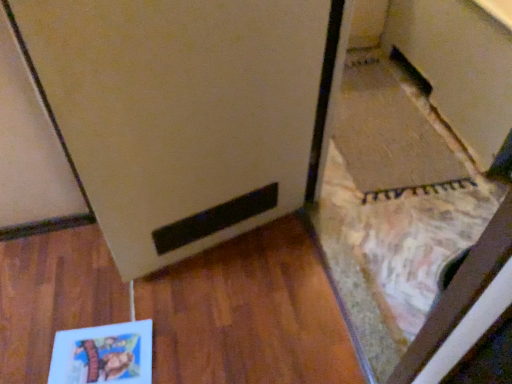
Question: Is matte brown cabinet at lower right positioned far away from matte paper book at lower left?

Choices:
 (A) yes
 (B) no

Answer: (A)

Question: Can you confirm if matte brown cabinet at lower right is smaller than matte paper book at lower left?

Choices:
 (A) yes
 (B) no

Answer: (B)

Question: Is matte brown cabinet at lower right behind matte paper book at lower left?

Choices:
 (A) no
 (B) yes

Answer: (B)

Question: Does matte brown cabinet at lower right have a greater height compared to matte paper book at lower left?

Choices:
 (A) yes
 (B) no

Answer: (A)

Question: From the image's perspective, is matte brown cabinet at lower right located beneath matte paper book at lower left?

Choices:
 (A) yes
 (B) no

Answer: (B)

Question: Is matte paper book at lower left in front of or behind matte brown cabinet at lower right in the image?

Choices:
 (A) front
 (B) behind

Answer: (A)

Question: Is matte paper book at lower left bigger or smaller than matte brown cabinet at lower right?

Choices:
 (A) big
 (B) small

Answer: (B)

Question: From their relative heights in the image, would you say matte paper book at lower left is taller or shorter than matte brown cabinet at lower right?

Choices:
 (A) tall
 (B) short

Answer: (B)

Question: From the image's perspective, is matte paper book at lower left positioned above or below matte brown cabinet at lower right?

Choices:
 (A) above
 (B) below

Answer: (B)

Question: Is matte brown cabinet at lower right bigger or smaller than matte paper book at lower left?

Choices:
 (A) big
 (B) small

Answer: (A)

Question: Is point (484, 117) positioned closer to the camera than point (54, 370)?

Choices:
 (A) closer
 (B) farther

Answer: (B)

Question: Based on their positions, is matte brown cabinet at lower right located to the left or right of matte paper book at lower left?

Choices:
 (A) left
 (B) right

Answer: (B)

Question: From the image's perspective, is matte brown cabinet at lower right above or below matte paper book at lower left?

Choices:
 (A) below
 (B) above

Answer: (B)

Question: Is matte paper book at lower left inside the boundaries of matte white fridge at center, or outside?

Choices:
 (A) outside
 (B) inside

Answer: (A)

Question: Relative to matte white fridge at center, is matte paper book at lower left in front or behind?

Choices:
 (A) front
 (B) behind

Answer: (B)